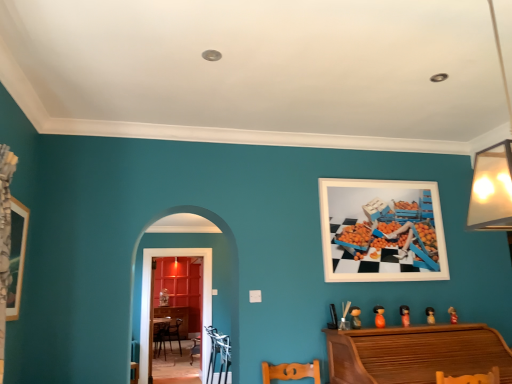
Question: From a real-world perspective, is wooden dresser at center physically below metallic silver armchair at lower center?

Choices:
 (A) yes
 (B) no

Answer: (B)

Question: Are wooden dresser at center and metallic silver armchair at lower center located far from each other?

Choices:
 (A) yes
 (B) no

Answer: (A)

Question: Is wooden dresser at center in front of metallic silver armchair at lower center?

Choices:
 (A) no
 (B) yes

Answer: (A)

Question: Considering the relative sizes of wooden dresser at center and metallic silver armchair at lower center in the image provided, is wooden dresser at center smaller than metallic silver armchair at lower center?

Choices:
 (A) yes
 (B) no

Answer: (B)

Question: Can you confirm if wooden dresser at center is shorter than metallic silver armchair at lower center?

Choices:
 (A) yes
 (B) no

Answer: (B)

Question: From a real-world perspective, is wooden table at center above or below wooden dresser at center?

Choices:
 (A) below
 (B) above

Answer: (A)

Question: Is wooden table at center spatially inside wooden dresser at center, or outside of it?

Choices:
 (A) inside
 (B) outside

Answer: (B)

Question: Based on their sizes in the image, would you say wooden table at center is bigger or smaller than wooden dresser at center?

Choices:
 (A) small
 (B) big

Answer: (B)

Question: From the image's perspective, is wooden table at center located above or below wooden dresser at center?

Choices:
 (A) below
 (B) above

Answer: (A)

Question: Relative to metallic silver armchair at lower center, is orange matte toy at lower right, which is the 4th toy from right to left, in front or behind?

Choices:
 (A) front
 (B) behind

Answer: (A)

Question: Based on their positions, is orange matte toy at lower right, which is the 4th toy from right to left, located to the left or right of metallic silver armchair at lower center?

Choices:
 (A) right
 (B) left

Answer: (A)

Question: Is orange matte toy at lower right, the 2th toy viewed from the left, wider or thinner than metallic silver armchair at lower center?

Choices:
 (A) thin
 (B) wide

Answer: (A)

Question: Considering the positions of orange matte toy at lower right, the 2th toy viewed from the left, and metallic silver armchair at lower center in the image, is orange matte toy at lower right, the 2th toy viewed from the left, taller or shorter than metallic silver armchair at lower center?

Choices:
 (A) short
 (B) tall

Answer: (A)

Question: Based on their sizes in the image, would you say white matte picture frame at upper right, arranged as the first picture frame when viewed from the back, is bigger or smaller than wooden picture frame at left, acting as the second picture frame starting from the right?

Choices:
 (A) small
 (B) big

Answer: (B)

Question: Based on their positions, is white matte picture frame at upper right, marked as the first picture frame in a right-to-left arrangement, located to the left or right of wooden picture frame at left, which is the first picture frame in left-to-right order?

Choices:
 (A) right
 (B) left

Answer: (A)